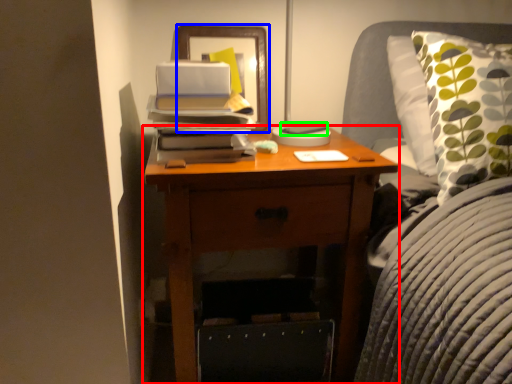
Question: Which object is the farthest from nightstand (highlighted by a red box)? Choose among these: picture frame (highlighted by a blue box) or paperback book (highlighted by a green box).

Choices:
 (A) picture frame
 (B) paperback book

Answer: (B)